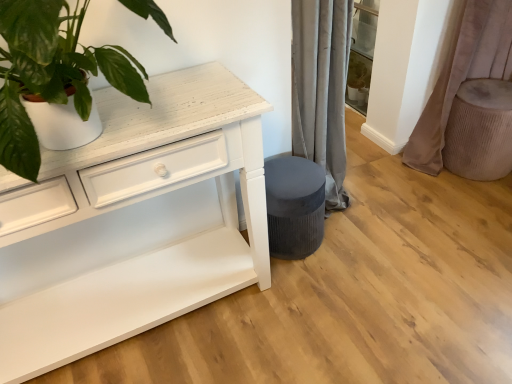
Question: Can we say velvet beige curtain at right lies outside white matte plant pot at upper left?

Choices:
 (A) no
 (B) yes

Answer: (B)

Question: From a real-world perspective, is velvet beige curtain at right on white matte plant pot at upper left?

Choices:
 (A) yes
 (B) no

Answer: (B)

Question: Does velvet beige curtain at right lie behind white matte plant pot at upper left?

Choices:
 (A) no
 (B) yes

Answer: (B)

Question: Is velvet beige curtain at right aimed at white matte plant pot at upper left?

Choices:
 (A) no
 (B) yes

Answer: (A)

Question: Is velvet beige curtain at right at the left side of white matte plant pot at upper left?

Choices:
 (A) no
 (B) yes

Answer: (A)

Question: From the image's perspective, does velvet beige curtain at right appear lower than white matte plant pot at upper left?

Choices:
 (A) yes
 (B) no

Answer: (B)

Question: From a real-world perspective, is beige textured ottoman at right over velvet beige curtain at right?

Choices:
 (A) no
 (B) yes

Answer: (A)

Question: Is beige textured ottoman at right positioned behind velvet beige curtain at right?

Choices:
 (A) no
 (B) yes

Answer: (B)

Question: Considering the relative positions of beige textured ottoman at right and velvet beige curtain at right in the image provided, is beige textured ottoman at right to the left of velvet beige curtain at right from the viewer's perspective?

Choices:
 (A) yes
 (B) no

Answer: (B)

Question: From the image's perspective, is beige textured ottoman at right located beneath velvet beige curtain at right?

Choices:
 (A) yes
 (B) no

Answer: (A)

Question: Is beige textured ottoman at right not within velvet beige curtain at right?

Choices:
 (A) yes
 (B) no

Answer: (B)

Question: Is beige textured ottoman at right at the right side of velvet beige curtain at right?

Choices:
 (A) yes
 (B) no

Answer: (A)

Question: Can beige textured ottoman at right be found inside white matte plant pot at upper left?

Choices:
 (A) no
 (B) yes

Answer: (A)